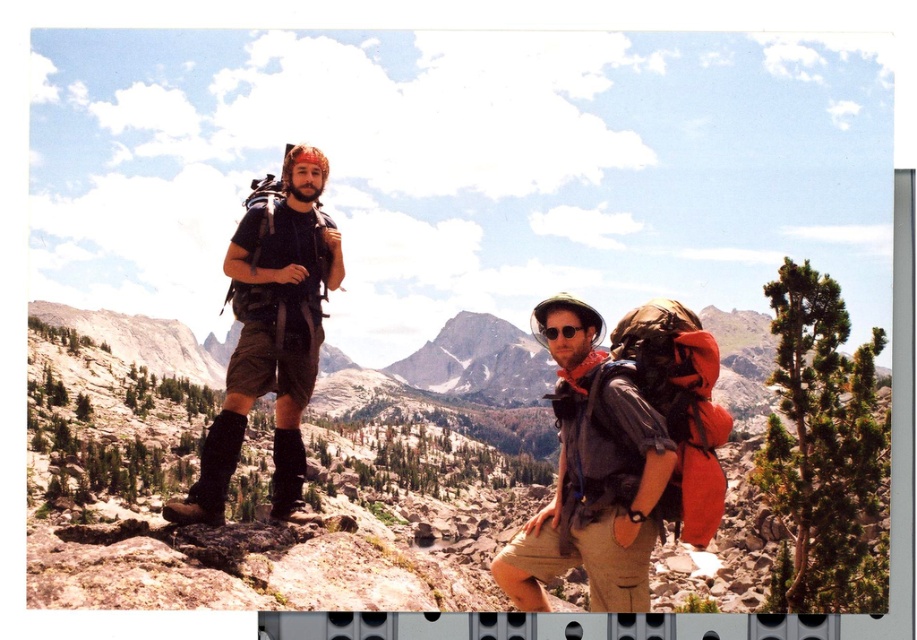
Question: Which point is farther from the camera taking this photo?

Choices:
 (A) (228, 413)
 (B) (297, 147)

Answer: (B)

Question: Is matte black backpack at left further to camera compared to black suede boot at center?

Choices:
 (A) no
 (B) yes

Answer: (A)

Question: Is matte black backpack at left bigger than black suede boot at center?

Choices:
 (A) yes
 (B) no

Answer: (A)

Question: Which point is farther from the camera taking this photo?

Choices:
 (A) (562, 330)
 (B) (306, 522)
 (C) (522, 561)

Answer: (A)

Question: Can you confirm if black suede boot at center is bigger than matte black goggles at center?

Choices:
 (A) no
 (B) yes

Answer: (B)

Question: Based on their relative distances, which object is farther from the black suede boot at center?

Choices:
 (A) brown textured backpack at center
 (B) matte black backpack at left
 (C) leather boot at left

Answer: (A)